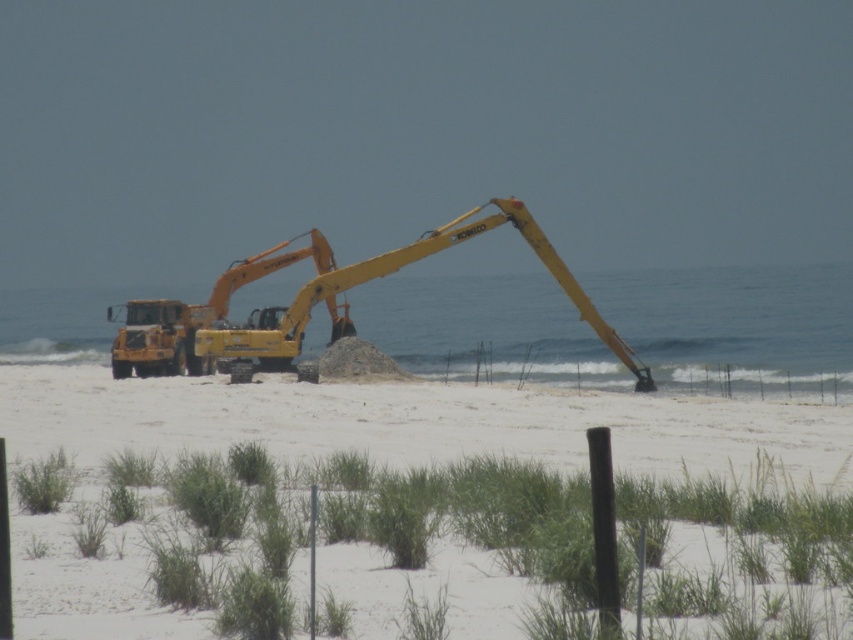
Is point (315, 452) farther from camera compared to point (154, 352)?

No, (315, 452) is in front of (154, 352).

Between point (701, 451) and point (238, 380), which one is positioned in front?

Point (701, 451)

Who is more distant from viewer, [366,403] or [166,330]?

The point [166,330] is behind.

Image resolution: width=853 pixels, height=640 pixels. Find the location of `white sand beach at center`. white sand beach at center is located at coordinates (413, 422).